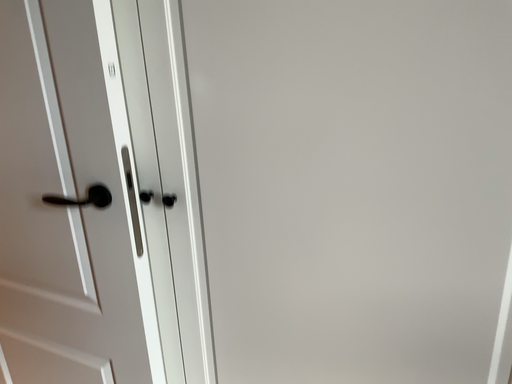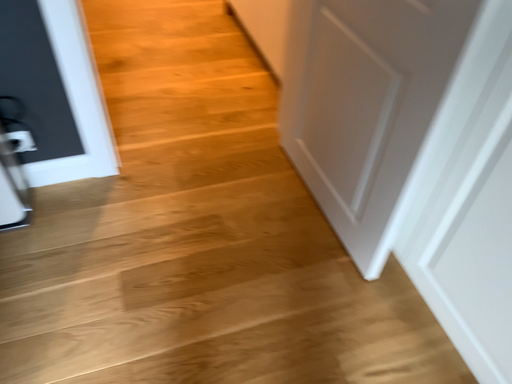
Question: How did the camera likely rotate when shooting the video?

Choices:
 (A) rotated left
 (B) rotated right

Answer: (A)